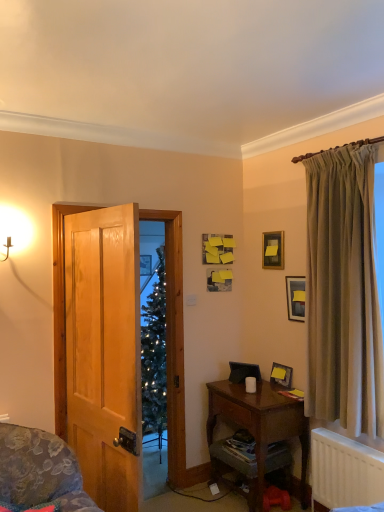
I want to click on vacant area on the back side of white matte coffee cup at lower center, so click(242, 386).